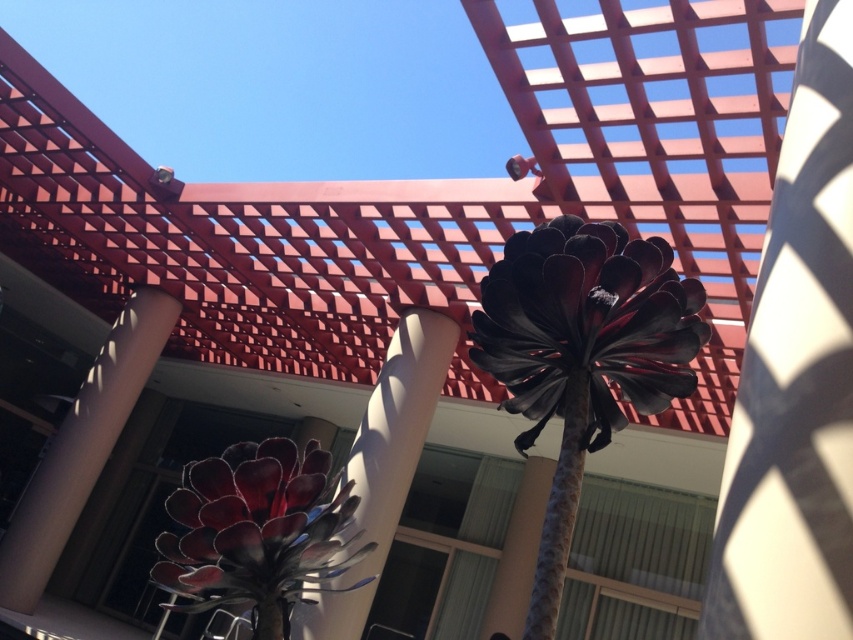
You are a photographer standing at the base of the structure. You want to capture a closeup shot of the metallic black flower at center without including the red lattice structure in the background. Is the distance sufficient to achieve this with a standard camera lens?

The metallic black flower at center is 63.34 centimeters away from camera. With a standard camera lens, this distance should allow for a closeup shot while keeping the red lattice structure out of the frame.

You are an architect designing a new installation. You have a metallic red flower at center and a white glossy pillar at center in your design. If you want to place a decorative light between them, which object should the light be closer to based on their widths?

The metallic red flower at center has a lesser width compared to the white glossy pillar at center, so the decorative light should be placed closer to the metallic red flower at center to balance the composition.

You are an architect designing a new plaza and want to ensure that the metallic red flower at center is visually balanced with the white glossy pillar at center. Given their sizes, which object should be placed farther away from the viewer to maintain visual balance?

The metallic red flower at center is smaller in size compared to the white glossy pillar at center. To maintain visual balance, the smaller metallic red flower at center should be placed closer to the viewer, while the larger white glossy pillar at center should be placed farther away. This way, their perceived sizes from the viewer will be more balanced.